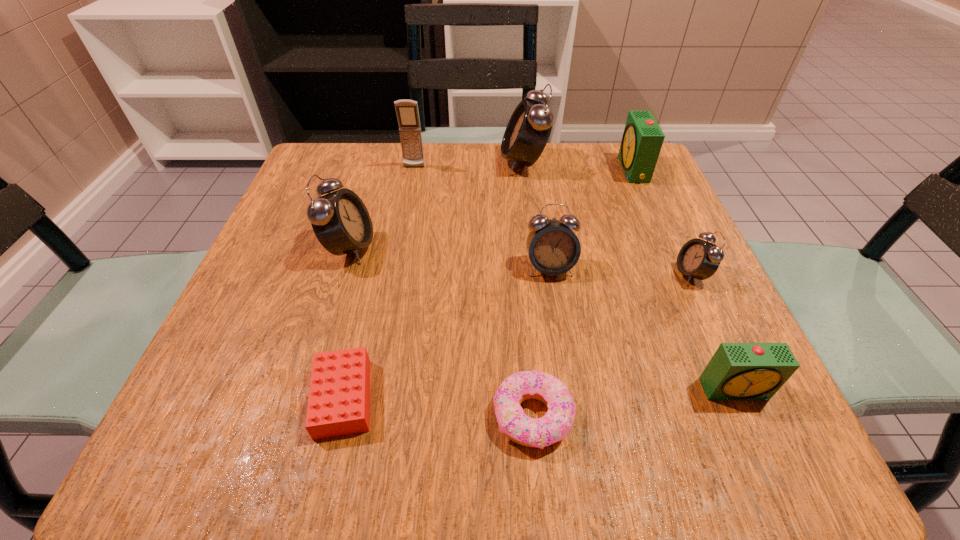
Find the location of a particular element. Image resolution: width=960 pixels, height=540 pixels. vacant area that lies between the cellular telephone and the third biggest white alarm clock is located at coordinates (482, 217).

Image resolution: width=960 pixels, height=540 pixels. Find the location of `vacant space that is in between the farthest white alarm clock and the farther green alarm clock`. vacant space that is in between the farthest white alarm clock and the farther green alarm clock is located at coordinates (578, 166).

The image size is (960, 540). I want to click on empty space between the Lego and the biggest white alarm clock, so click(434, 280).

Find the location of `vacant area that lies between the farther green alarm clock and the second tallest alarm clock`. vacant area that lies between the farther green alarm clock and the second tallest alarm clock is located at coordinates (492, 208).

At what (x,y) coordinates should I click in order to perform the action: click on free space between the gray cellular telephone and the farthest white alarm clock. Please return your answer as a coordinate pair (x, y). Looking at the image, I should click on (468, 165).

At what (x,y) coordinates should I click in order to perform the action: click on free spot between the tallest alarm clock and the third biggest white alarm clock. Please return your answer as a coordinate pair (x, y). This screenshot has width=960, height=540. Looking at the image, I should click on (537, 215).

You are a GUI agent. You are given a task and a screenshot of the screen. Output one action in this format:
    pyautogui.click(x=<x>, y=<y>)
    Task: Click on the vacant region between the Lego and the smallest white alarm clock
    The height and width of the screenshot is (540, 960).
    Given the screenshot: What is the action you would take?
    pyautogui.click(x=517, y=336)

What are the coordinates of `free space between the second smallest white alarm clock and the Lego` in the screenshot? It's located at (446, 333).

This screenshot has height=540, width=960. I want to click on blank region between the smallest white alarm clock and the biggest white alarm clock, so [608, 218].

Image resolution: width=960 pixels, height=540 pixels. What are the coordinates of `the fifth closest object relative to the leftmost alarm clock` in the screenshot? It's located at (554, 426).